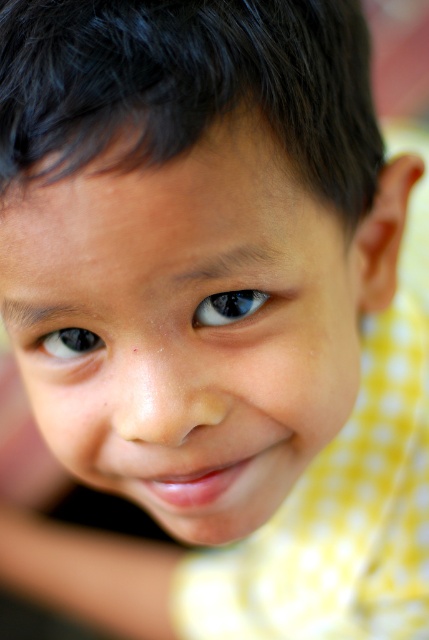
Based on the scene description, can you determine if the smooth skin face at center is wider than the black glossy eye at center?

The smooth skin face at center is wider than the black glossy eye at center according to the description.

The child has two eyes, a blue glossy eye at center and a black glossy eye at center. Which one is closer to the viewer?

The blue glossy eye at center is closer to the viewer as it is positioned in front of the black glossy eye at center.